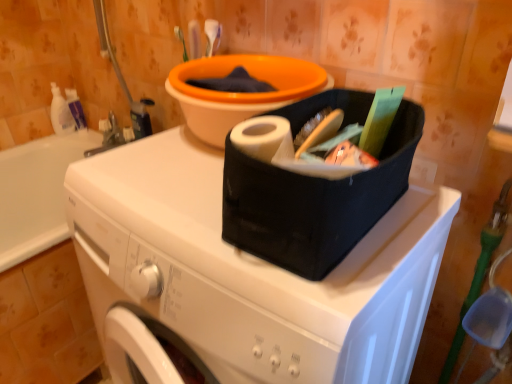
What do you see at coordinates (61, 113) in the screenshot?
I see `white glossy bottle at left, the 2th cleaning product viewed from the right` at bounding box center [61, 113].

Measure the distance between white matte washing machine at center and camera.

The distance of white matte washing machine at center from camera is 46.64 centimeters.

What is the approximate height of white matte washing machine at center?

It is 33.50 inches.

What is the approximate width of white plastic bottle at upper left, marked as the 1th cleaning product in a right-to-left arrangement?

white plastic bottle at upper left, marked as the 1th cleaning product in a right-to-left arrangement, is 3.99 inches wide.

What do you see at coordinates (76, 108) in the screenshot?
I see `white plastic bottle at upper left, marked as the 1th cleaning product in a right-to-left arrangement` at bounding box center [76, 108].

This screenshot has width=512, height=384. What do you see at coordinates (240, 92) in the screenshot?
I see `orange plastic basin at upper center` at bounding box center [240, 92].

Locate an element on the screen. white glossy bottle at left, marked as the 1th cleaning product in a left-to-right arrangement is located at coordinates (61, 113).

Is white plastic bottle at upper left, marked as the 1th cleaning product in a right-to-left arrangement, positioned in front of white matte washing machine at center?

No, it is behind white matte washing machine at center.

Who is smaller, white plastic bottle at upper left, which is the 2th cleaning product in left-to-right order, or white matte washing machine at center?

With smaller size is white plastic bottle at upper left, which is the 2th cleaning product in left-to-right order.

From the image's perspective, between white plastic bottle at upper left, which is the 2th cleaning product in left-to-right order, and white matte washing machine at center, which one is located above?

white plastic bottle at upper left, which is the 2th cleaning product in left-to-right order, appears higher in the image.

Which of these two, white plastic bottle at upper left, which is the 2th cleaning product in left-to-right order, or orange plastic basin at upper center, is smaller?

white plastic bottle at upper left, which is the 2th cleaning product in left-to-right order.

Between white plastic bottle at upper left, marked as the 1th cleaning product in a right-to-left arrangement, and orange plastic basin at upper center, which one is positioned in front?

Positioned in front is orange plastic basin at upper center.

Considering the relative sizes of white plastic bottle at upper left, which is the 2th cleaning product in left-to-right order, and orange plastic basin at upper center in the image provided, is white plastic bottle at upper left, which is the 2th cleaning product in left-to-right order, taller than orange plastic basin at upper center?

Yes, white plastic bottle at upper left, which is the 2th cleaning product in left-to-right order, is taller than orange plastic basin at upper center.

Does point (71, 98) come farther from viewer compared to point (200, 66)?

That is True.

Is white glossy bottle at left, marked as the 1th cleaning product in a left-to-right arrangement, touching orange plastic basin at upper center?

white glossy bottle at left, marked as the 1th cleaning product in a left-to-right arrangement, and orange plastic basin at upper center are clearly separated.

From the image's perspective, is white glossy bottle at left, the 2th cleaning product viewed from the right, located above orange plastic basin at upper center?

Yes, from the image's perspective, white glossy bottle at left, the 2th cleaning product viewed from the right, is above orange plastic basin at upper center.

In the scene shown: Considering the relative sizes of white glossy bottle at left, marked as the 1th cleaning product in a left-to-right arrangement, and orange plastic basin at upper center in the image provided, is white glossy bottle at left, marked as the 1th cleaning product in a left-to-right arrangement, smaller than orange plastic basin at upper center?

Correct, white glossy bottle at left, marked as the 1th cleaning product in a left-to-right arrangement, occupies less space than orange plastic basin at upper center.

Is white glossy bottle at left, the 2th cleaning product viewed from the right, at the left side of orange plastic basin at upper center?

Yes.

Are white glossy bottle at left, the 2th cleaning product viewed from the right, and white matte washing machine at center beside each other?

No, white glossy bottle at left, the 2th cleaning product viewed from the right, is not next to white matte washing machine at center.

Is white glossy bottle at left, the 2th cleaning product viewed from the right, facing towards white matte washing machine at center?

Yes, white glossy bottle at left, the 2th cleaning product viewed from the right, is aimed at white matte washing machine at center.

Which object is further away from the camera, white glossy bottle at left, the 2th cleaning product viewed from the right, or white matte washing machine at center?

white glossy bottle at left, the 2th cleaning product viewed from the right, is more distant.

From a real-world perspective, is white glossy bottle at left, the 2th cleaning product viewed from the right, under white matte washing machine at center?

No.

Is white glossy bottle at left, marked as the 1th cleaning product in a left-to-right arrangement, with white plastic bottle at upper left, which is the 2th cleaning product in left-to-right order?

Yes, white glossy bottle at left, marked as the 1th cleaning product in a left-to-right arrangement, and white plastic bottle at upper left, which is the 2th cleaning product in left-to-right order, clearly make contact.

Which of these two, white glossy bottle at left, the 2th cleaning product viewed from the right, or white plastic bottle at upper left, marked as the 1th cleaning product in a right-to-left arrangement, is wider?

white plastic bottle at upper left, marked as the 1th cleaning product in a right-to-left arrangement, is wider.

Locate an element on the screen. cleaning product that is above the white glossy bottle at left, the 2th cleaning product viewed from the right (from the image's perspective) is located at coordinates (76, 108).

Can you confirm if white glossy bottle at left, marked as the 1th cleaning product in a left-to-right arrangement, is bigger than white plastic bottle at upper left, marked as the 1th cleaning product in a right-to-left arrangement?

Correct, white glossy bottle at left, marked as the 1th cleaning product in a left-to-right arrangement, is larger in size than white plastic bottle at upper left, marked as the 1th cleaning product in a right-to-left arrangement.

From the image's perspective, which one is positioned lower, white matte washing machine at center or orange plastic basin at upper center?

white matte washing machine at center.

Does white matte washing machine at center appear on the left side of orange plastic basin at upper center?

Indeed, white matte washing machine at center is positioned on the left side of orange plastic basin at upper center.

Which is correct: white matte washing machine at center is inside orange plastic basin at upper center, or outside of it?

white matte washing machine at center exists outside the volume of orange plastic basin at upper center.

Which of these two, white matte washing machine at center or orange plastic basin at upper center, is smaller?

orange plastic basin at upper center is smaller.

Where is `the 1st cleaning product above the white matte washing machine at center (from the image's perspective)`? the 1st cleaning product above the white matte washing machine at center (from the image's perspective) is located at coordinates (61, 113).

From a real-world perspective, between white matte washing machine at center and white glossy bottle at left, the 2th cleaning product viewed from the right, who is vertically lower?

From a 3D spatial view, white matte washing machine at center is below.

Is white matte washing machine at center oriented away from white glossy bottle at left, the 2th cleaning product viewed from the right?

No, white matte washing machine at center's orientation is not away from white glossy bottle at left, the 2th cleaning product viewed from the right.

Are white matte washing machine at center and white glossy bottle at left, the 2th cleaning product viewed from the right, beside each other?

No, white matte washing machine at center is not beside white glossy bottle at left, the 2th cleaning product viewed from the right.

At what (x,y) coordinates should I click in order to perform the action: click on washing machine on the right of white plastic bottle at upper left, which is the 2th cleaning product in left-to-right order. Please return your answer as a coordinate pair (x, y). Image resolution: width=512 pixels, height=384 pixels. Looking at the image, I should click on (249, 272).

Identify the location of the 2nd cleaning product behind the orange plastic basin at upper center, counting from the anchor's position. This screenshot has height=384, width=512. (76, 108).

Looking at the image, which one is located closer to white matte washing machine at center, orange plastic basin at upper center or white glossy bottle at left, marked as the 1th cleaning product in a left-to-right arrangement?

orange plastic basin at upper center lies closer to white matte washing machine at center than the other object.

Consider the image. Estimate the real-world distances between objects in this image. Which object is further from white glossy bottle at left, marked as the 1th cleaning product in a left-to-right arrangement, white plastic bottle at upper left, which is the 2th cleaning product in left-to-right order, or orange plastic basin at upper center?

orange plastic basin at upper center.

From the image, which object appears to be nearer to orange plastic basin at upper center, white matte washing machine at center or white glossy bottle at left, the 2th cleaning product viewed from the right?

white matte washing machine at center is closer to orange plastic basin at upper center.

Based on their spatial positions, is white glossy bottle at left, the 2th cleaning product viewed from the right, or white plastic bottle at upper left, marked as the 1th cleaning product in a right-to-left arrangement, further from orange plastic basin at upper center?

Based on the image, white glossy bottle at left, the 2th cleaning product viewed from the right, appears to be further to orange plastic basin at upper center.

When comparing their distances from white glossy bottle at left, marked as the 1th cleaning product in a left-to-right arrangement, does white matte washing machine at center or orange plastic basin at upper center seem further?

white matte washing machine at center.

Looking at the image, which one is located further to white plastic bottle at upper left, which is the 2th cleaning product in left-to-right order, white glossy bottle at left, the 2th cleaning product viewed from the right, or orange plastic basin at upper center?

The object further to white plastic bottle at upper left, which is the 2th cleaning product in left-to-right order, is orange plastic basin at upper center.

Considering their positions, is white matte washing machine at center positioned closer to white plastic bottle at upper left, marked as the 1th cleaning product in a right-to-left arrangement, than white glossy bottle at left, marked as the 1th cleaning product in a left-to-right arrangement?

white glossy bottle at left, marked as the 1th cleaning product in a left-to-right arrangement, lies closer to white plastic bottle at upper left, marked as the 1th cleaning product in a right-to-left arrangement, than the other object.

Based on their spatial positions, is white glossy bottle at left, the 2th cleaning product viewed from the right, or white matte washing machine at center closer to orange plastic basin at upper center?

The object closer to orange plastic basin at upper center is white matte washing machine at center.

The height and width of the screenshot is (384, 512). What are the coordinates of `cleaning product positioned between white matte washing machine at center and white plastic bottle at upper left, marked as the 1th cleaning product in a right-to-left arrangement, from near to far` in the screenshot? It's located at (61, 113).

The height and width of the screenshot is (384, 512). I want to click on basin between white matte washing machine at center and white plastic bottle at upper left, which is the 2th cleaning product in left-to-right order, from front to back, so click(x=240, y=92).

Find the location of a particular element. This screenshot has height=384, width=512. basin between white matte washing machine at center and white glossy bottle at left, the 2th cleaning product viewed from the right, along the z-axis is located at coordinates (240, 92).

Where is `cleaning product positioned between orange plastic basin at upper center and white plastic bottle at upper left, marked as the 1th cleaning product in a right-to-left arrangement, from near to far`? Image resolution: width=512 pixels, height=384 pixels. cleaning product positioned between orange plastic basin at upper center and white plastic bottle at upper left, marked as the 1th cleaning product in a right-to-left arrangement, from near to far is located at coordinates (61, 113).